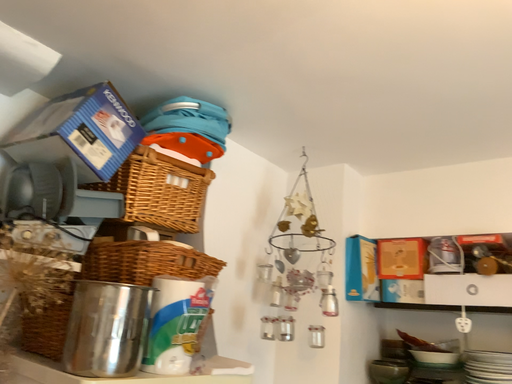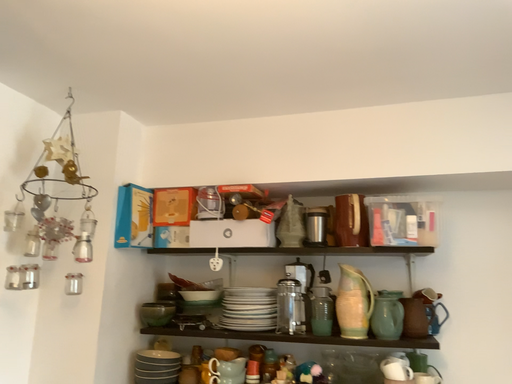
Question: Which way did the camera rotate in the video?

Choices:
 (A) rotated right
 (B) rotated left

Answer: (A)